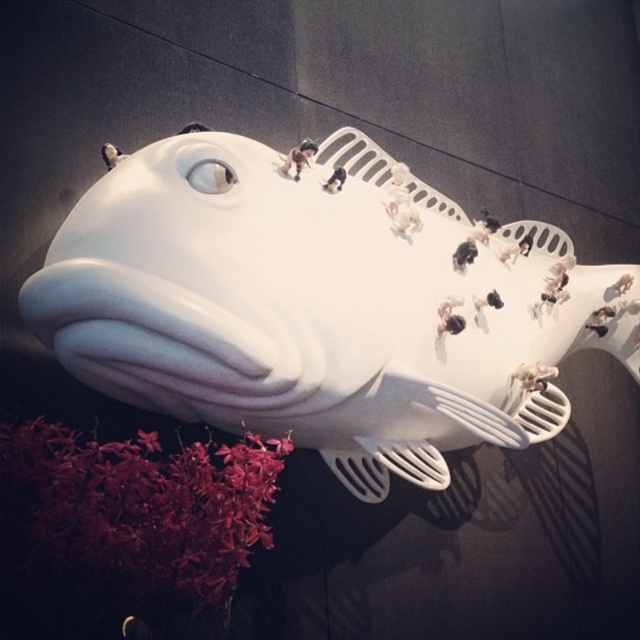
Is white glossy fish at center smaller than velvety crimson blooms at bottom left?

No.

Between white glossy fish at center and velvety crimson blooms at bottom left, which one appears on the left side from the viewer's perspective?

velvety crimson blooms at bottom left is more to the left.

Which is in front, point (413, 205) or point (172, 476)?

Point (172, 476) is more forward.

Find the location of a particular element. white glossy fish at center is located at coordinates (320, 307).